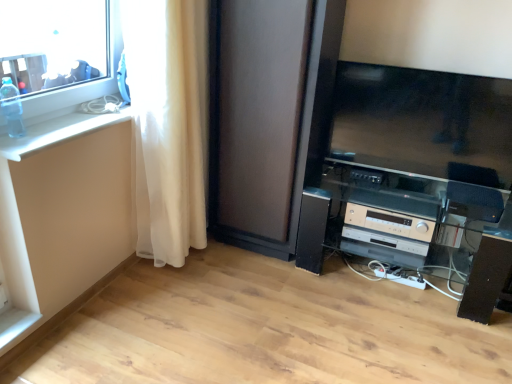
This screenshot has width=512, height=384. Find the location of `free space on the front side of satin black entertainment center at lower right`. free space on the front side of satin black entertainment center at lower right is located at coordinates (394, 342).